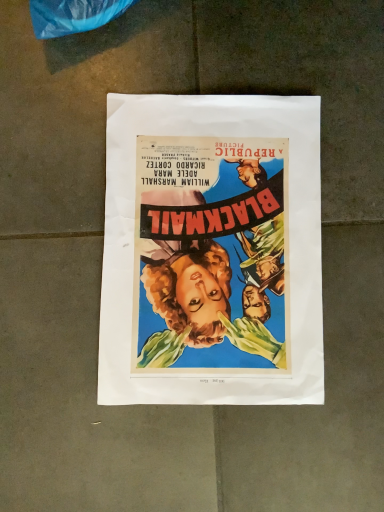
At what (x,y) coordinates should I click in order to perform the action: click on empty space that is ontop of vibrant paper poster at center. Please return your answer as a coordinate pair (x, y). Looking at the image, I should click on (215, 242).